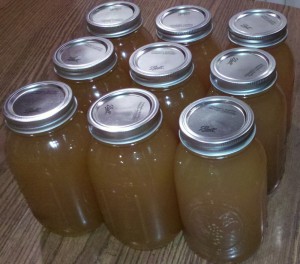
Where is `bottom row of jars`? This screenshot has height=264, width=300. bottom row of jars is located at coordinates (59, 201), (119, 193), (216, 195).